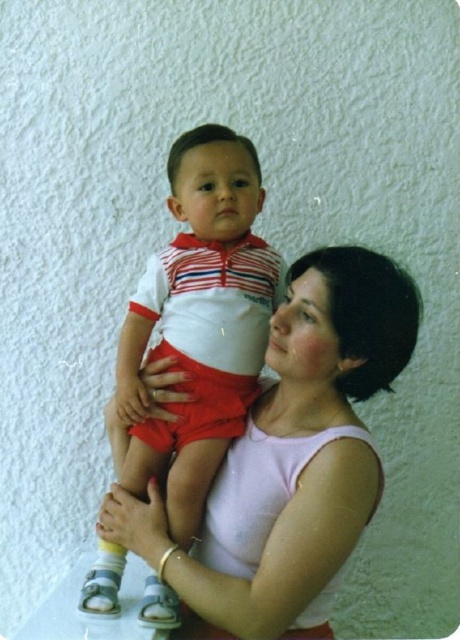
Question: Is pink fabric shirt at center to the right of matte white and red striped shirt at center from the viewer's perspective?

Choices:
 (A) yes
 (B) no

Answer: (A)

Question: Can you confirm if pink fabric shirt at center is positioned to the left of matte white and red striped shirt at center?

Choices:
 (A) no
 (B) yes

Answer: (A)

Question: Among these objects, which one is farthest from the camera?

Choices:
 (A) matte white and red striped shirt at center
 (B) pink fabric shirt at center

Answer: (A)

Question: Among these objects, which one is farthest from the camera?

Choices:
 (A) matte white and red striped shirt at center
 (B) pink fabric shirt at center

Answer: (A)

Question: Does pink fabric shirt at center have a smaller size compared to matte white and red striped shirt at center?

Choices:
 (A) no
 (B) yes

Answer: (A)